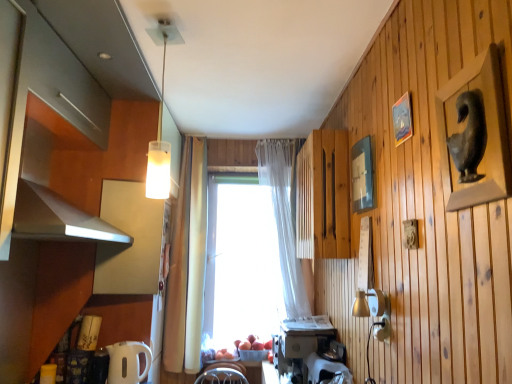
Question: Is transparent glass window at center inside white plastic coffee maker at lower center, acting as the 2th appliance starting from the right?

Choices:
 (A) yes
 (B) no

Answer: (B)

Question: From a real-world perspective, is white plastic coffee maker at lower center, which is the second appliance from left to right, located higher than transparent glass window at center?

Choices:
 (A) yes
 (B) no

Answer: (B)

Question: Considering the relative positions of white plastic coffee maker at lower center, which is the second appliance from left to right, and transparent glass window at center in the image provided, is white plastic coffee maker at lower center, which is the second appliance from left to right, to the left of transparent glass window at center from the viewer's perspective?

Choices:
 (A) no
 (B) yes

Answer: (A)

Question: Can we say white plastic coffee maker at lower center, acting as the 2th appliance starting from the right, lies outside transparent glass window at center?

Choices:
 (A) no
 (B) yes

Answer: (B)

Question: Is white plastic coffee maker at lower center, acting as the 2th appliance starting from the right, shorter than transparent glass window at center?

Choices:
 (A) yes
 (B) no

Answer: (A)

Question: Can you confirm if white plastic coffee maker at lower center, acting as the 2th appliance starting from the right, is bigger than transparent glass window at center?

Choices:
 (A) yes
 (B) no

Answer: (B)

Question: Can you confirm if translucent glass pendant light at upper center is thinner than matte gray statue at upper right, the third picture frame when ordered from back to front?

Choices:
 (A) yes
 (B) no

Answer: (B)

Question: Could you tell me if translucent glass pendant light at upper center is facing matte gray statue at upper right, the third picture frame when ordered from back to front?

Choices:
 (A) yes
 (B) no

Answer: (B)

Question: From the image's perspective, is translucent glass pendant light at upper center over matte gray statue at upper right, the first picture frame when ordered from front to back?

Choices:
 (A) yes
 (B) no

Answer: (A)

Question: Considering the relative sizes of translucent glass pendant light at upper center and matte gray statue at upper right, the first picture frame when ordered from front to back, in the image provided, is translucent glass pendant light at upper center smaller than matte gray statue at upper right, the first picture frame when ordered from front to back,?

Choices:
 (A) no
 (B) yes

Answer: (A)

Question: Is translucent glass pendant light at upper center to the left of matte gray statue at upper right, the third picture frame when ordered from back to front, from the viewer's perspective?

Choices:
 (A) yes
 (B) no

Answer: (A)

Question: From the image's perspective, is translucent glass pendant light at upper center below matte gray statue at upper right, the third picture frame when ordered from back to front?

Choices:
 (A) no
 (B) yes

Answer: (A)

Question: Is wooden slats at center, the third cabinetry in the left-to-right sequence, positioned with its back to white plastic coffee maker at lower center, which is the second appliance from left to right?

Choices:
 (A) no
 (B) yes

Answer: (A)